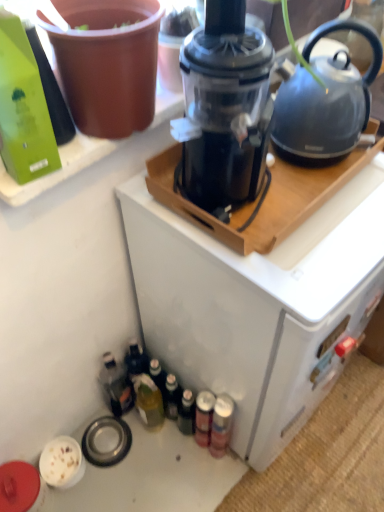
Locate an element on the screen. This screenshot has width=384, height=512. vacant space in front of matte gray kettle at upper right is located at coordinates (353, 215).